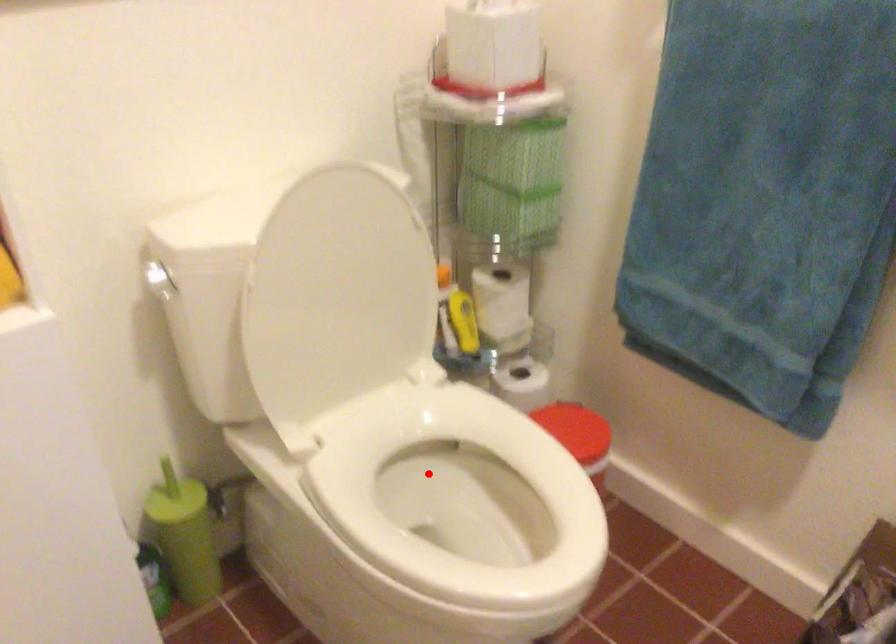
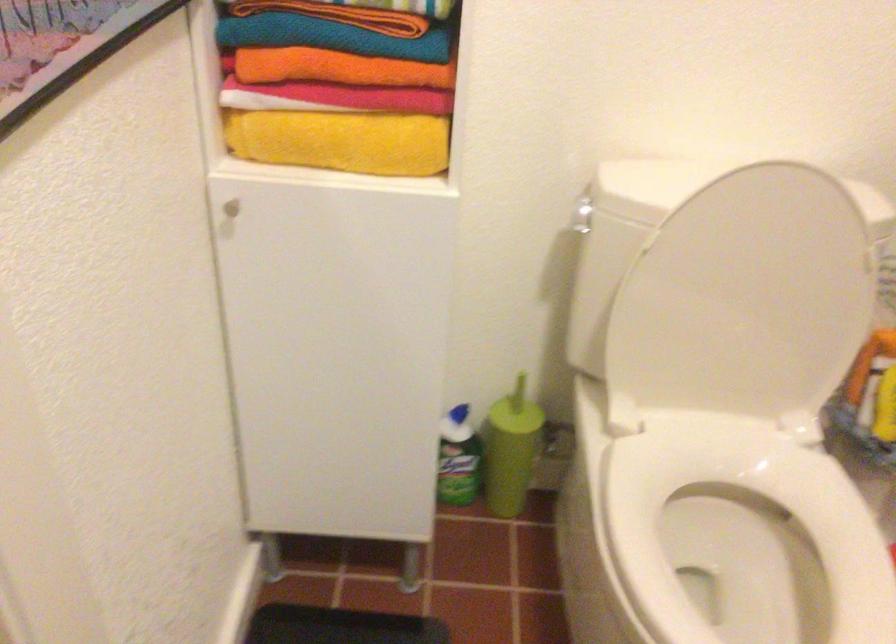
Where in the second image is the point corresponding to the highlighted location from the first image?

(742, 525)